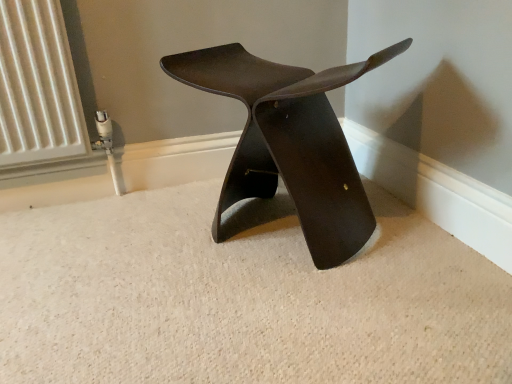
The width and height of the screenshot is (512, 384). I want to click on matte black stool at center, so click(289, 142).

Measure the distance between point (252, 171) and camera.

The depth of point (252, 171) is 3.53 feet.

Describe the element at coordinates (289, 142) in the screenshot. I see `matte black stool at center` at that location.

Where is `matte black stool at center`? The image size is (512, 384). matte black stool at center is located at coordinates (289, 142).